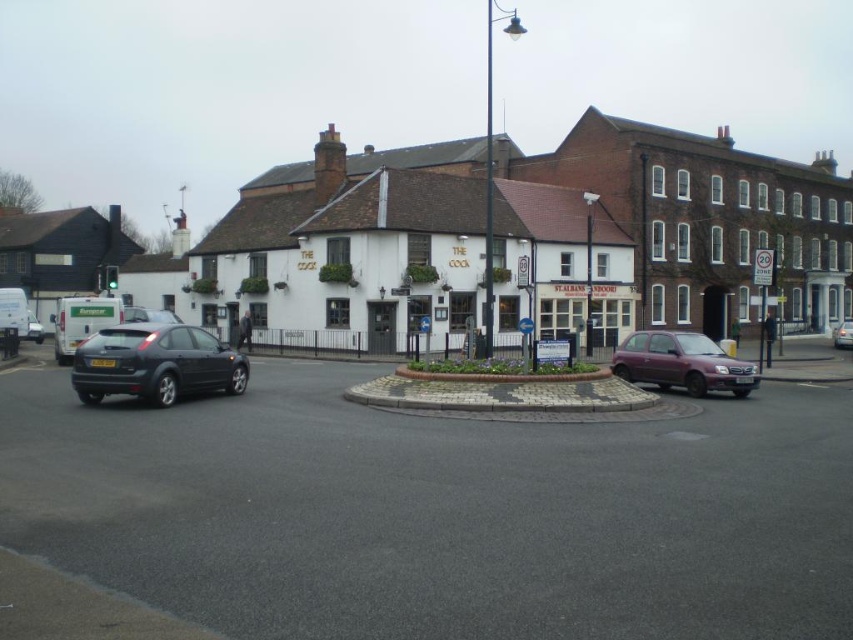
Is matte black hatchback at left wider than silver metallic car at center?

Incorrect, matte black hatchback at left's width does not surpass silver metallic car at center's.

Is matte black hatchback at left taller than silver metallic car at center?

No, matte black hatchback at left is not taller than silver metallic car at center.

The image size is (853, 640). I want to click on matte black hatchback at left, so click(155, 364).

Find the location of `matte black hatchback at left`. matte black hatchback at left is located at coordinates (155, 364).

Can you confirm if black asphalt at center is smaller than matte black hatchback at left?

No.

Who is more distant from viewer, (466, 516) or (99, 376)?

The point (99, 376) is behind.

Locate an element on the screen. black asphalt at center is located at coordinates (440, 512).

Can you confirm if silver metallic car at center is bigger than matte black car at left?

Correct, silver metallic car at center is larger in size than matte black car at left.

Can you confirm if silver metallic car at center is smaller than matte black car at left?

Incorrect, silver metallic car at center is not smaller in size than matte black car at left.

What do you see at coordinates (842, 333) in the screenshot? This screenshot has width=853, height=640. I see `silver metallic car at center` at bounding box center [842, 333].

Find the location of a particular element. silver metallic car at center is located at coordinates tap(842, 333).